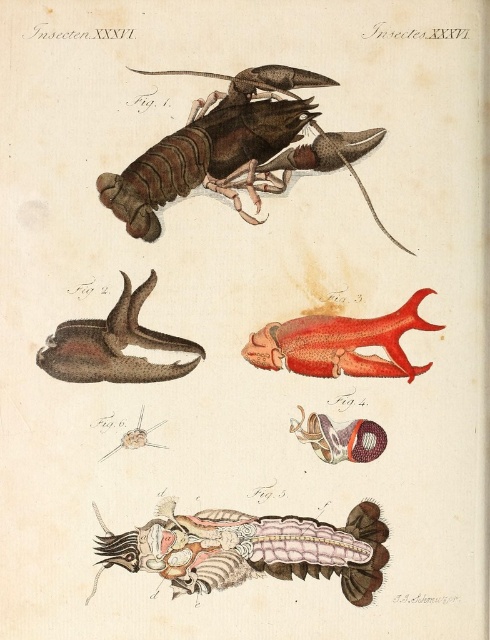
You are an entomologist examining a scientific illustration of a lobster. The illustration has a coordinate system where the bottom left corner is the origin point. You need to locate the brown matte lobster at upper center. What are its coordinates?

The coordinates of the brown matte lobster at upper center are at point (x=235, y=148).

You are examining a scientific illustration of a lobster. There is a point labeled at coordinates (235,148). What object is located at this point?

The brown matte lobster at upper center is located at point (235,148).